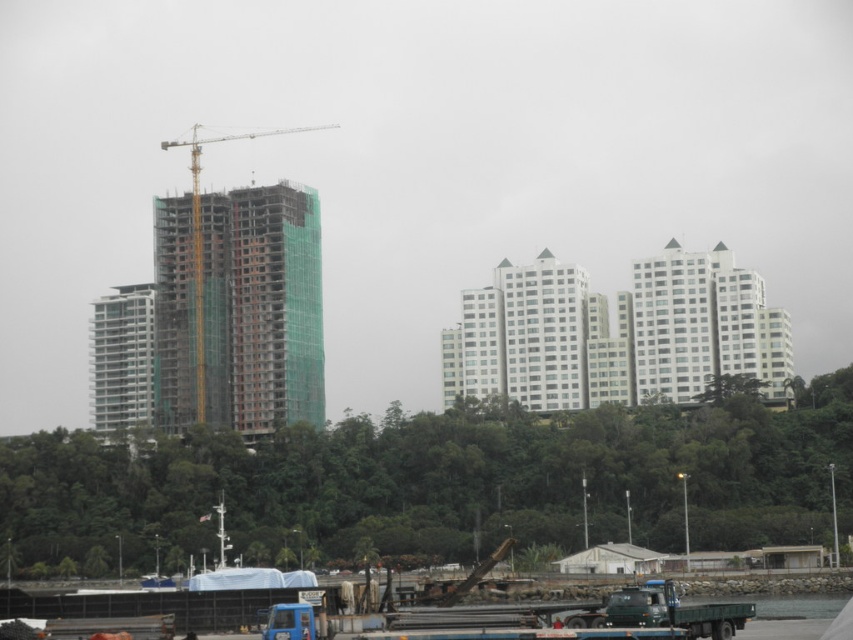
Question: Which object is farther from the camera taking this photo?

Choices:
 (A) white glass building at left
 (B) green matte truck at lower center
 (C) metallic yellow crane at center-left

Answer: (C)

Question: Based on their relative distances, which object is farther from the white glass building at left?

Choices:
 (A) clear water at lower right
 (B) metallic yellow crane at center-left

Answer: (A)

Question: Is green matte truck at lower center to the right of clear water at lower right from the viewer's perspective?

Choices:
 (A) yes
 (B) no

Answer: (B)

Question: Does metallic yellow crane at center-left appear over green matte truck at lower center?

Choices:
 (A) no
 (B) yes

Answer: (B)

Question: Considering the real-world distances, which object is farthest from the white glass building at left?

Choices:
 (A) green matte truck at lower center
 (B) clear water at lower right

Answer: (A)

Question: Is metallic yellow crane at center-left smaller than white glass building at left?

Choices:
 (A) no
 (B) yes

Answer: (A)